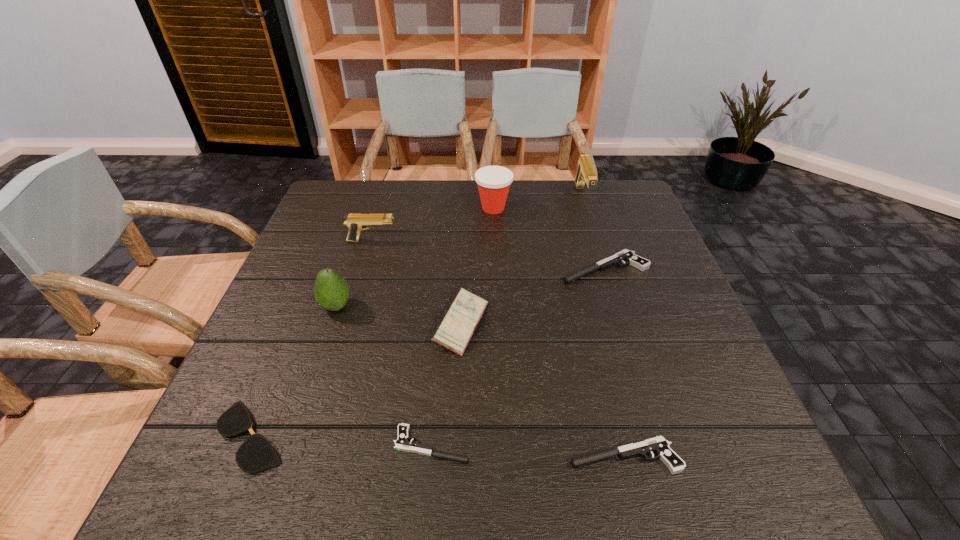
You are a GUI agent. You are given a task and a screenshot of the screen. Output one action in this format:
    pyautogui.click(x=<x>, y=<y>)
    Task: Click on the second shortest pistol
    The image size is (960, 540).
    Given the screenshot: What is the action you would take?
    click(659, 445)

Identify the location of spectacles. This screenshot has height=540, width=960. (256, 453).

Where is `the smallest black pistol`? This screenshot has height=540, width=960. the smallest black pistol is located at coordinates (402, 443).

Locate an element on the screen. This screenshot has height=540, width=960. the shortest pistol is located at coordinates click(x=402, y=443).

Identify the location of vacant space situated at the barrel of the farther tan pistol. The width and height of the screenshot is (960, 540). (607, 272).

Locate an element on the screen. This screenshot has width=960, height=540. vacant position located on the left of the red-orange Dixie cup is located at coordinates (408, 208).

Locate an element on the screen. vacant space positioned 0.360m on the front of the avocado is located at coordinates point(277,480).

The image size is (960, 540). Identify the location of vacant area situated 0.250m at the barrel of the left tan pistol. (489, 241).

Locate an element on the screen. The width and height of the screenshot is (960, 540). vacant space situated 0.300m on the right of the diary is located at coordinates (624, 325).

Where is `vacant point located 0.350m on the front-facing side of the farthest black pistol`? vacant point located 0.350m on the front-facing side of the farthest black pistol is located at coordinates (421, 268).